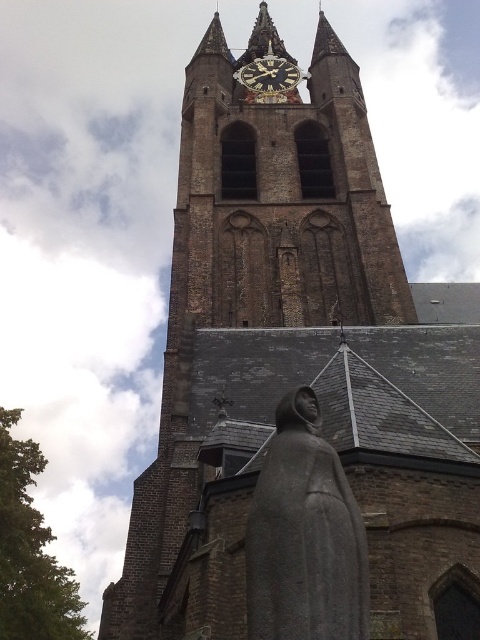
Question: Does brown stone clock tower at center appear on the left side of gray stone statue at center?

Choices:
 (A) yes
 (B) no

Answer: (B)

Question: Which point appears farthest from the camera in this image?

Choices:
 (A) (347, 323)
 (B) (243, 81)
 (C) (315, 500)

Answer: (B)

Question: Which object is the farthest from the dark brown wooden clock at center?

Choices:
 (A) gray stone statue at center
 (B) brown stone clock tower at center

Answer: (A)

Question: Is gray stone statue at center closer to the viewer compared to dark brown wooden clock at center?

Choices:
 (A) yes
 (B) no

Answer: (A)

Question: Observing the image, what is the correct spatial positioning of brown stone clock tower at center in reference to gray stone statue at center?

Choices:
 (A) right
 (B) left

Answer: (A)

Question: Which object appears closest to the camera in this image?

Choices:
 (A) brown stone clock tower at center
 (B) dark brown wooden clock at center
 (C) gray stone statue at center

Answer: (C)